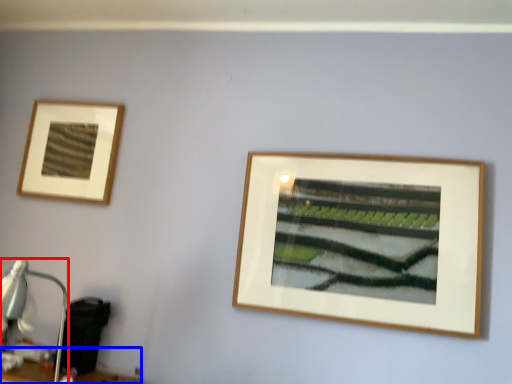
Question: Which object appears farthest to the camera in this image, table lamp (highlighted by a red box) or table (highlighted by a blue box)?

Choices:
 (A) table lamp
 (B) table

Answer: (B)